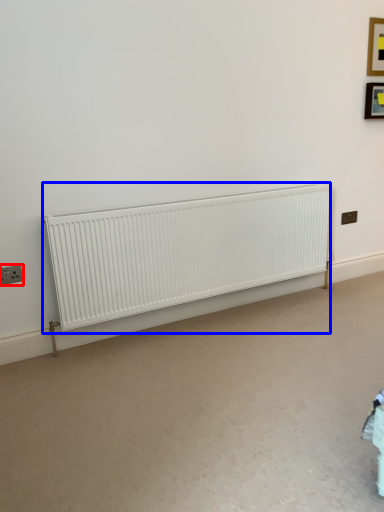
Question: Which point is further to the camera, electric outlet (highlighted by a red box) or radiator (highlighted by a blue box)?

Choices:
 (A) electric outlet
 (B) radiator

Answer: (A)